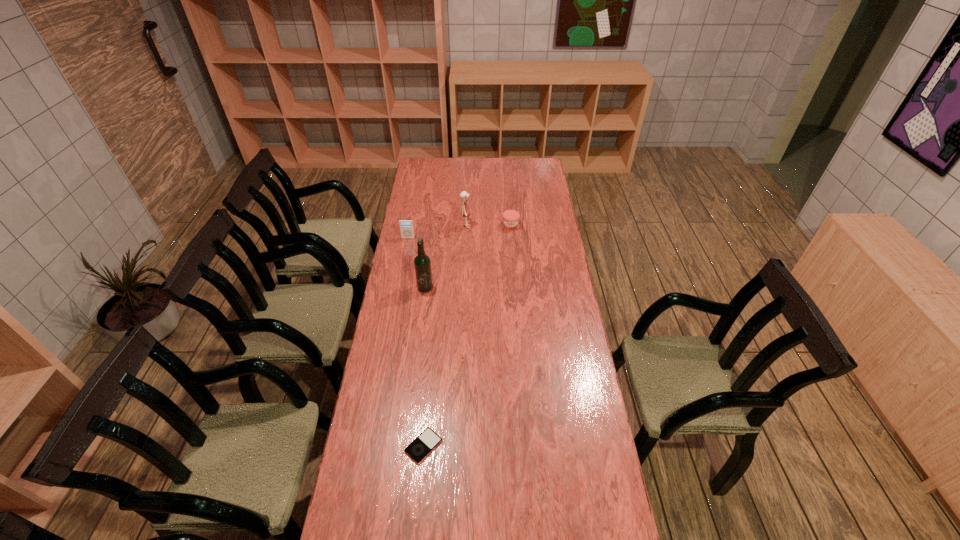
Identify the location of the fourth farthest object. (422, 263).

Find the location of a particular element. This screenshot has width=960, height=540. the tallest object is located at coordinates (422, 263).

The image size is (960, 540). I want to click on doll, so click(465, 211).

Where is `the second tallest object`? the second tallest object is located at coordinates coord(465,211).

I want to click on the third farthest object, so click(406, 225).

Locate an element on the screen. This screenshot has width=960, height=540. the left iPod is located at coordinates (406, 225).

Locate an element on the screen. the second shortest object is located at coordinates (510, 217).

This screenshot has height=540, width=960. I want to click on jam, so click(510, 217).

I want to click on the nearest object, so click(x=428, y=440).

The height and width of the screenshot is (540, 960). I want to click on the right iPod, so pos(428,440).